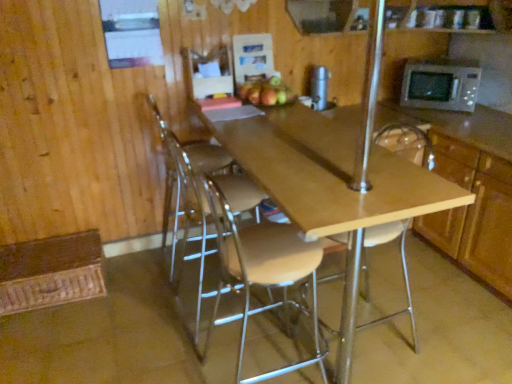
Locate an element on the screen. free space between wooden seat at center, the 1th chair positioned from the right, and light brown wood stool at center, positioned as the 2th chair in right-to-left order is located at coordinates (309, 347).